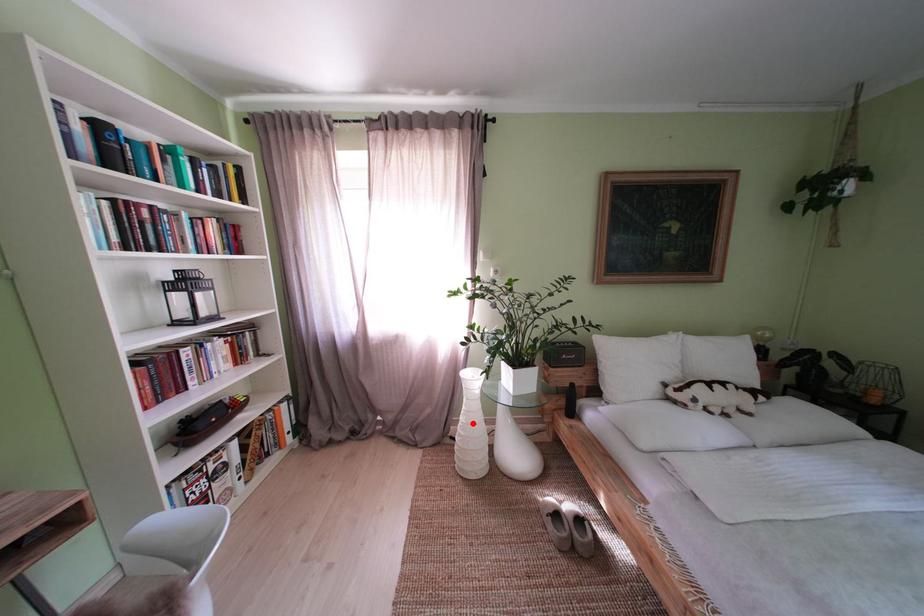
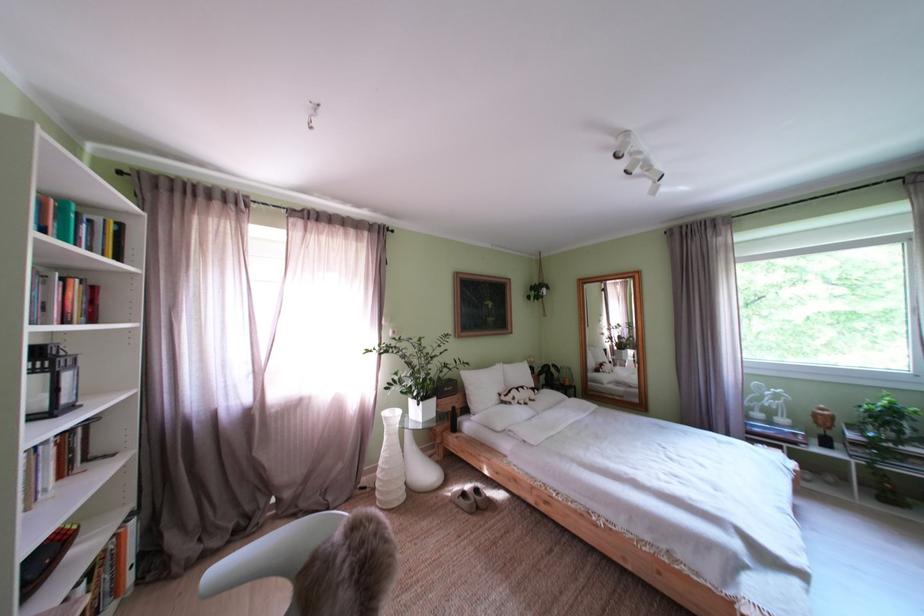
Question: I am providing you with two images of the same scene from different viewpoints. A red point is shown in image1. For the corresponding object point in image2, is it positioned nearer or farther from the camera?

Choices:
 (A) Nearer
 (B) Farther

Answer: (A)